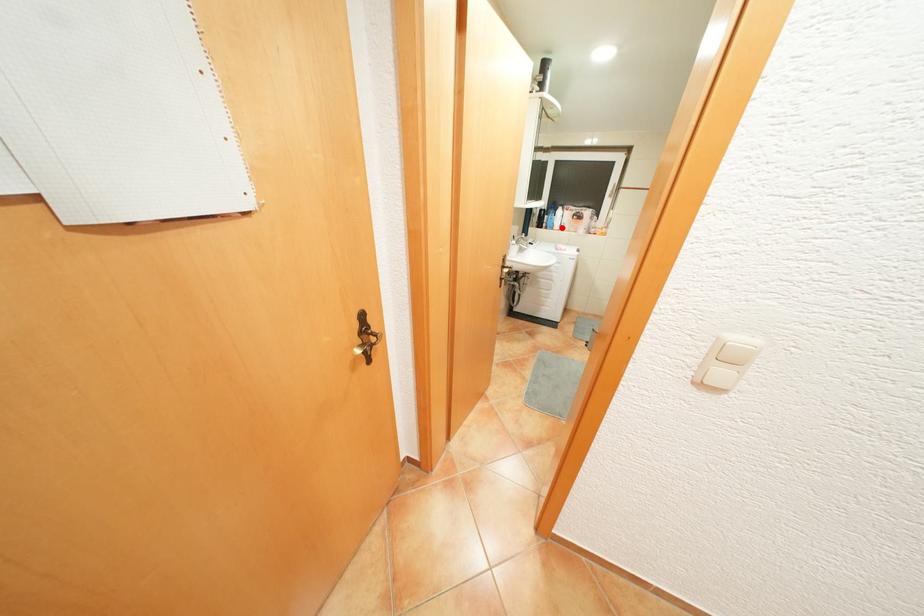
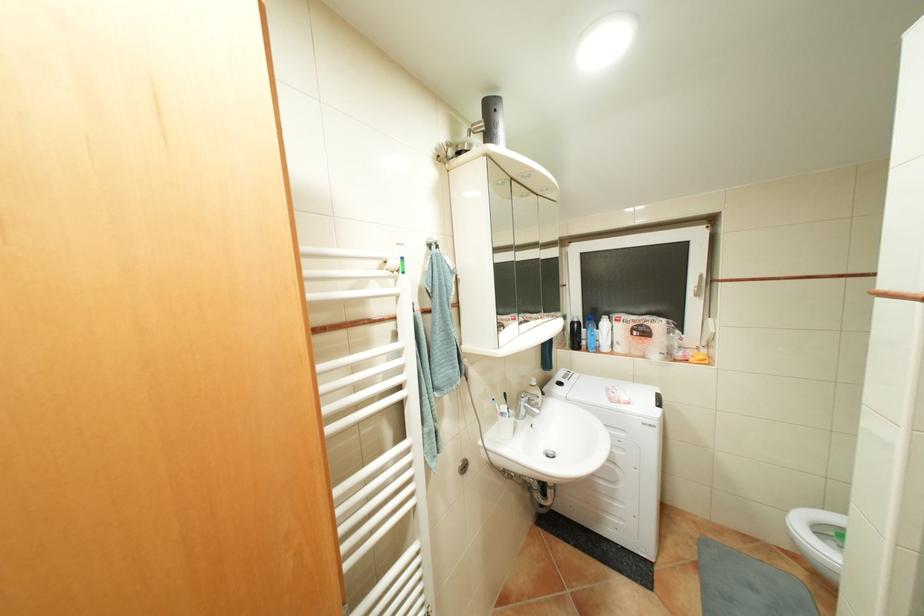
The point at the highlighted location is marked in the first image. Where is the corresponding point in the second image?

(608, 350)